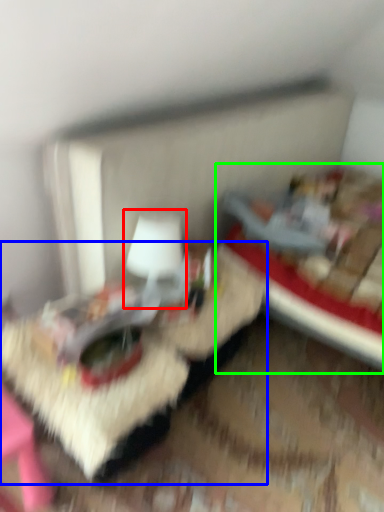
Question: Which object is positioned closest to table lamp (highlighted by a red box)? Select from table (highlighted by a blue box) and bed (highlighted by a green box).

Choices:
 (A) table
 (B) bed

Answer: (A)